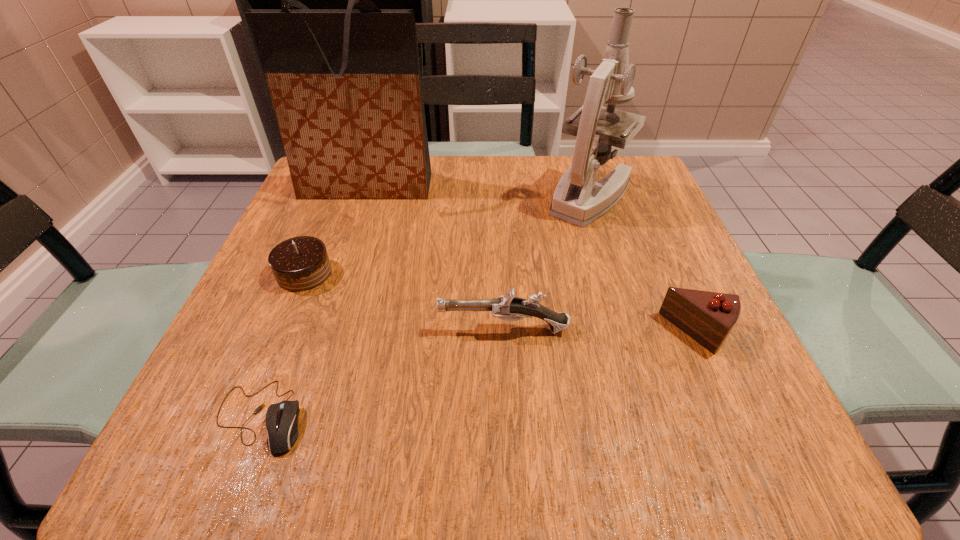
At what (x,y) coordinates should I click in order to perform the action: click on shopping bag. Please return your answer as a coordinate pair (x, y). The height and width of the screenshot is (540, 960). Looking at the image, I should click on click(346, 87).

The image size is (960, 540). I want to click on microscope, so click(x=578, y=199).

Where is `the third object from right to left`? The height and width of the screenshot is (540, 960). the third object from right to left is located at coordinates (507, 307).

At what (x,y) coordinates should I click in order to perform the action: click on the third farthest object. Please return your answer as a coordinate pair (x, y). Looking at the image, I should click on (301, 263).

Find the location of a particular element. The width and height of the screenshot is (960, 540). the left chocolate cake is located at coordinates (301, 263).

Locate an element on the screen. the nearer chocolate cake is located at coordinates (708, 317).

Locate an element on the screen. This screenshot has height=540, width=960. the nearest object is located at coordinates (281, 419).

Where is `computer mouse`? computer mouse is located at coordinates (281, 419).

Find the location of a particular element. The image size is (960, 540). free space located on the front-facing side of the shopping bag is located at coordinates (339, 267).

I want to click on free space located 0.050m on the right of the microscope, so click(657, 195).